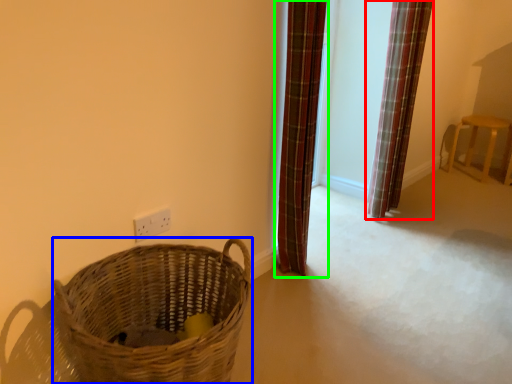
Question: Estimate the real-world distances between objects in this image. Which object is farther from curtain (highlighted by a red box), basket (highlighted by a blue box) or curtain (highlighted by a green box)?

Choices:
 (A) basket
 (B) curtain

Answer: (A)